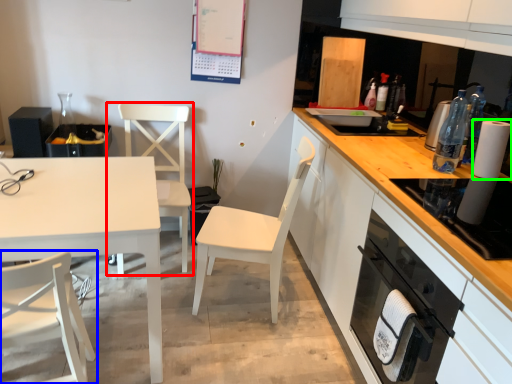
Question: Estimate the real-world distances between objects in this image. Which object is farther from chair (highlighted by a red box), chair (highlighted by a blue box) or paper towel (highlighted by a green box)?

Choices:
 (A) chair
 (B) paper towel

Answer: (B)